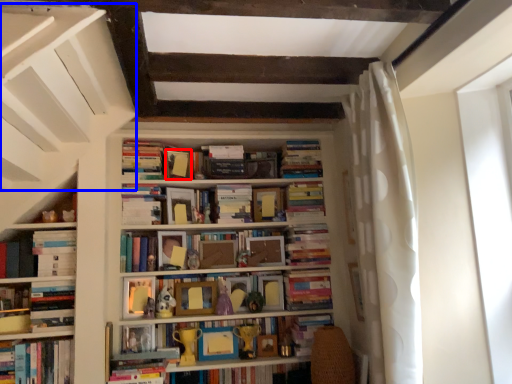
Question: Which object is further to the camera taking this photo, paperback book (highlighted by a red box) or stairwell (highlighted by a blue box)?

Choices:
 (A) paperback book
 (B) stairwell

Answer: (A)